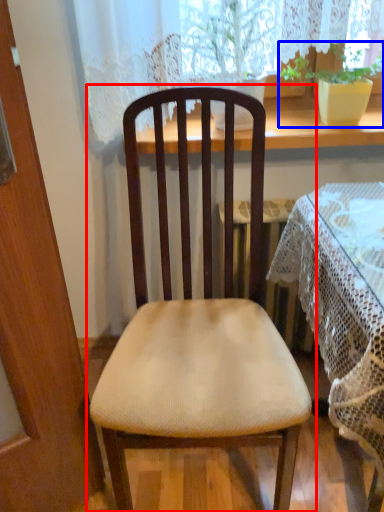
Question: Which object appears closest to the camera in this image, chair (highlighted by a red box) or houseplant (highlighted by a blue box)?

Choices:
 (A) chair
 (B) houseplant

Answer: (A)